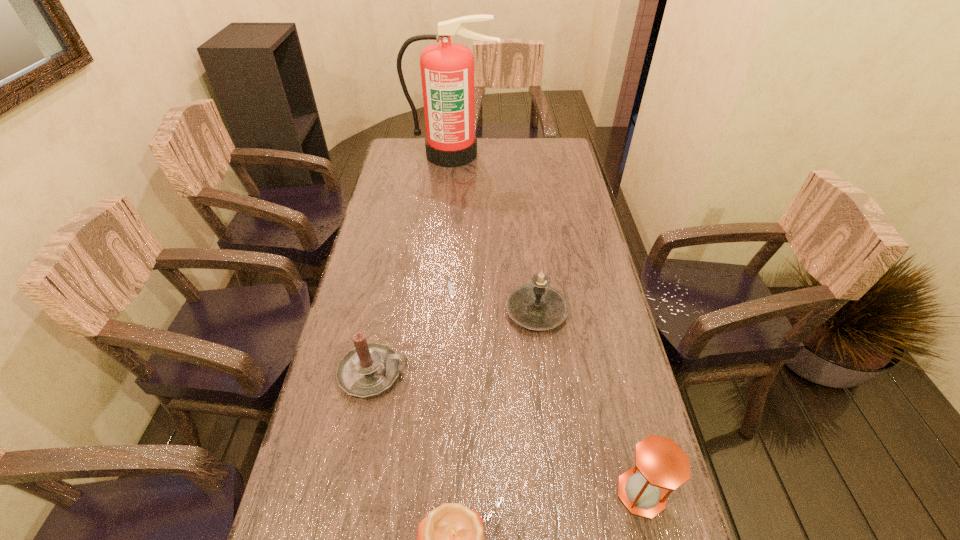
Where is `free region located on the back of the hourglass`? Image resolution: width=960 pixels, height=540 pixels. free region located on the back of the hourglass is located at coordinates (606, 350).

Locate an element on the screen. The height and width of the screenshot is (540, 960). object at the far edge is located at coordinates (447, 69).

I want to click on fire extinguisher located in the left edge section of the desktop, so click(447, 69).

Image resolution: width=960 pixels, height=540 pixels. In order to click on candle present at the left edge in this screenshot , I will do `click(369, 369)`.

Where is `candle that is at the right edge`? The width and height of the screenshot is (960, 540). candle that is at the right edge is located at coordinates (537, 306).

Locate an element on the screen. The width and height of the screenshot is (960, 540). hourglass situated at the right edge is located at coordinates (660, 464).

I want to click on object present at the far left corner, so click(447, 69).

Locate an element on the screen. vacant space at the far edge of the desktop is located at coordinates (480, 148).

The width and height of the screenshot is (960, 540). I want to click on blank space at the left edge, so click(367, 269).

This screenshot has height=540, width=960. What are the coordinates of `vacant space at the right edge of the desktop` in the screenshot? It's located at (579, 258).